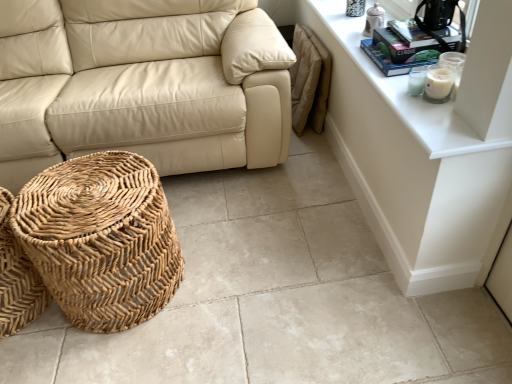
Question: Is woven natural basket at lower left, acting as the second basket starting from the right, behind beige leather couch at center?

Choices:
 (A) no
 (B) yes

Answer: (A)

Question: From a real-world perspective, is woven natural basket at lower left, acting as the 1th basket starting from the left, on beige leather couch at center?

Choices:
 (A) yes
 (B) no

Answer: (B)

Question: Is woven natural basket at lower left, acting as the second basket starting from the right, positioned with its back to beige leather couch at center?

Choices:
 (A) yes
 (B) no

Answer: (A)

Question: Is woven natural basket at lower left, acting as the second basket starting from the right, next to beige leather couch at center?

Choices:
 (A) no
 (B) yes

Answer: (A)

Question: Considering the relative sizes of woven natural basket at lower left, acting as the 1th basket starting from the left, and beige leather couch at center in the image provided, is woven natural basket at lower left, acting as the 1th basket starting from the left, thinner than beige leather couch at center?

Choices:
 (A) no
 (B) yes

Answer: (B)

Question: From the image's perspective, is woven natural basket at lower left, acting as the second basket starting from the right, beneath beige leather couch at center?

Choices:
 (A) yes
 (B) no

Answer: (A)

Question: Is hardcover book at upper right touching woven natural basket at lower left, acting as the 1th basket starting from the left?

Choices:
 (A) yes
 (B) no

Answer: (B)

Question: Does hardcover book at upper right have a greater height compared to woven natural basket at lower left, acting as the second basket starting from the right?

Choices:
 (A) no
 (B) yes

Answer: (A)

Question: Is hardcover book at upper right oriented away from woven natural basket at lower left, acting as the second basket starting from the right?

Choices:
 (A) yes
 (B) no

Answer: (B)

Question: Does hardcover book at upper right have a larger size compared to woven natural basket at lower left, acting as the second basket starting from the right?

Choices:
 (A) yes
 (B) no

Answer: (B)

Question: From the image's perspective, is hardcover book at upper right below woven natural basket at lower left, acting as the second basket starting from the right?

Choices:
 (A) no
 (B) yes

Answer: (A)

Question: Considering the relative positions of hardcover book at upper right and woven natural basket at lower left, acting as the second basket starting from the right, in the image provided, is hardcover book at upper right to the left of woven natural basket at lower left, acting as the second basket starting from the right, from the viewer's perspective?

Choices:
 (A) no
 (B) yes

Answer: (A)

Question: Is woven natural basket at lower left, acting as the second basket starting from the right, to the right of white glossy dresser at upper right from the viewer's perspective?

Choices:
 (A) no
 (B) yes

Answer: (A)